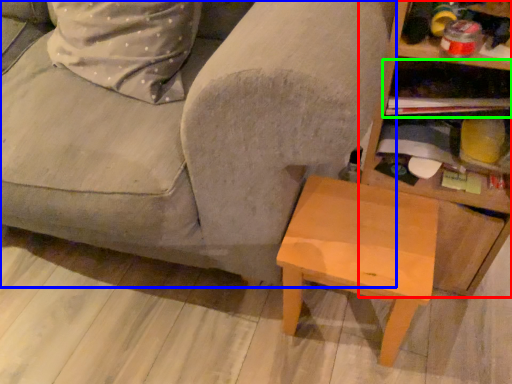
Question: Based on their relative distances, which object is nearer to shelf (highlighted by a red box)? Choose from studio couch (highlighted by a blue box) and shelf (highlighted by a green box).

Choices:
 (A) studio couch
 (B) shelf

Answer: (B)